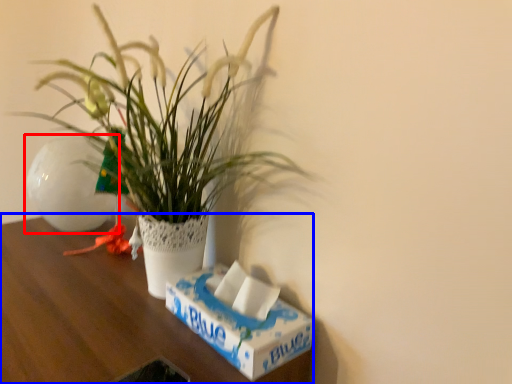
Question: Which point is further to the camera, flowerpot (highlighted by a red box) or table (highlighted by a blue box)?

Choices:
 (A) flowerpot
 (B) table

Answer: (A)